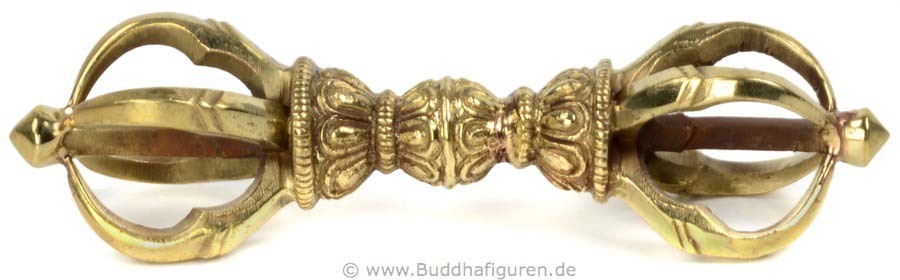
The width and height of the screenshot is (900, 280). What are the coordinates of `ribbed decoration` in the screenshot? It's located at (301, 148).